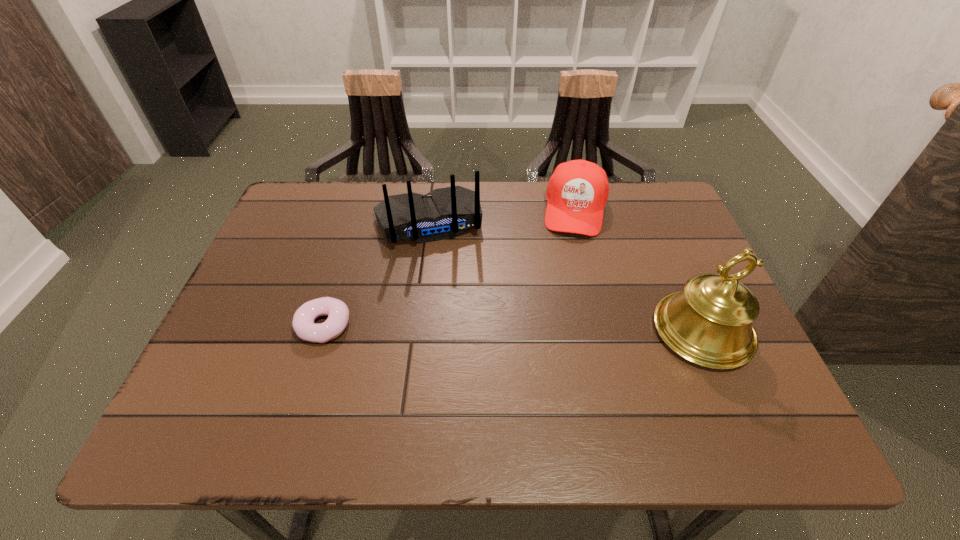
Where is `vacant space that is in between the second object from right to left and the rightmost object`? vacant space that is in between the second object from right to left and the rightmost object is located at coordinates (638, 271).

Identify the location of free point between the third object from left to right and the shortest object. (449, 267).

Locate an element on the screen. vacant region between the router and the doughnut is located at coordinates pyautogui.click(x=376, y=274).

The height and width of the screenshot is (540, 960). Identify the location of vacant space that's between the third object from left to right and the rightmost object. (638, 271).

In order to click on blank region between the third object from left to right and the shortest object in this screenshot , I will do `click(449, 267)`.

The height and width of the screenshot is (540, 960). What are the coordinates of `free space between the rightmost object and the shortest object` in the screenshot? It's located at (514, 328).

Select which object appears as the third closest to the rightmost object. Please provide its 2D coordinates. Your answer should be formatted as a tuple, i.e. [(x, y)], where the tuple contains the x and y coordinates of a point satisfying the conditions above.

[(338, 313)]

The width and height of the screenshot is (960, 540). In order to click on object that is the second closest to the baseball cap in this screenshot , I will do `click(709, 323)`.

At what (x,y) coordinates should I click in order to perform the action: click on vacant area in the image that satisfies the following two spatial constraints: 1. on the front side of the shortest object; 2. on the right side of the tallest object. Please return your answer as a coordinate pair (x, y). Looking at the image, I should click on (323, 331).

You are a GUI agent. You are given a task and a screenshot of the screen. Output one action in this format:
    pyautogui.click(x=<x>, y=<y>)
    Task: Click on the vacant region that satisfies the following two spatial constraints: 1. on the back side of the router; 2. on the left side of the shortest object
    The width and height of the screenshot is (960, 540).
    Given the screenshot: What is the action you would take?
    356,222